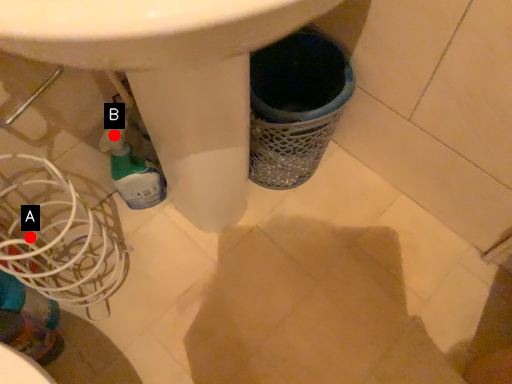
Question: Two points are circled on the image, labeled by A and B beside each circle. Which point is farther to the camera?

Choices:
 (A) A is further
 (B) B is further

Answer: (B)